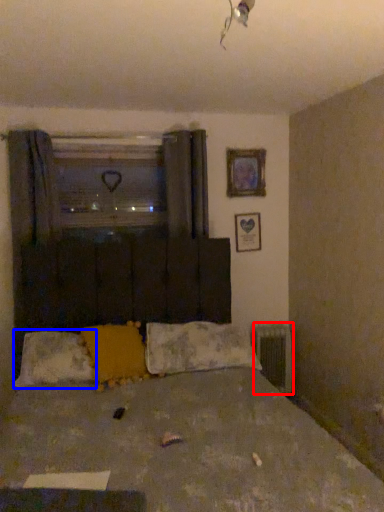
Question: Which point is closer to the camera, radiator (highlighted by a red box) or pillow (highlighted by a blue box)?

Choices:
 (A) radiator
 (B) pillow

Answer: (B)